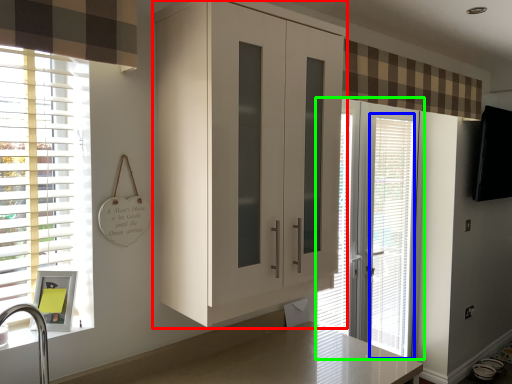
Question: Based on their relative distances, which object is farther from cabinetry (highlighted by a red box)? Choose from blind (highlighted by a blue box) and door (highlighted by a green box).

Choices:
 (A) blind
 (B) door

Answer: (A)